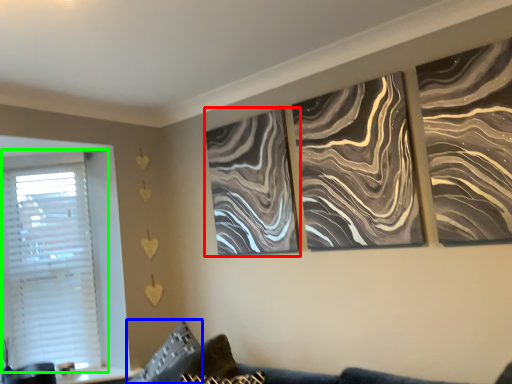
Question: Which is farther away from canvas (highlighted by a red box)? pillow (highlighted by a blue box) or window (highlighted by a green box)?

Choices:
 (A) pillow
 (B) window

Answer: (B)